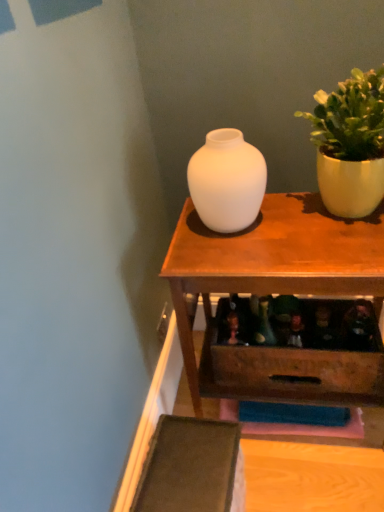
Locate an element on the screen. The image size is (384, 512). free point to the left of white matte vase at center is located at coordinates click(x=182, y=240).